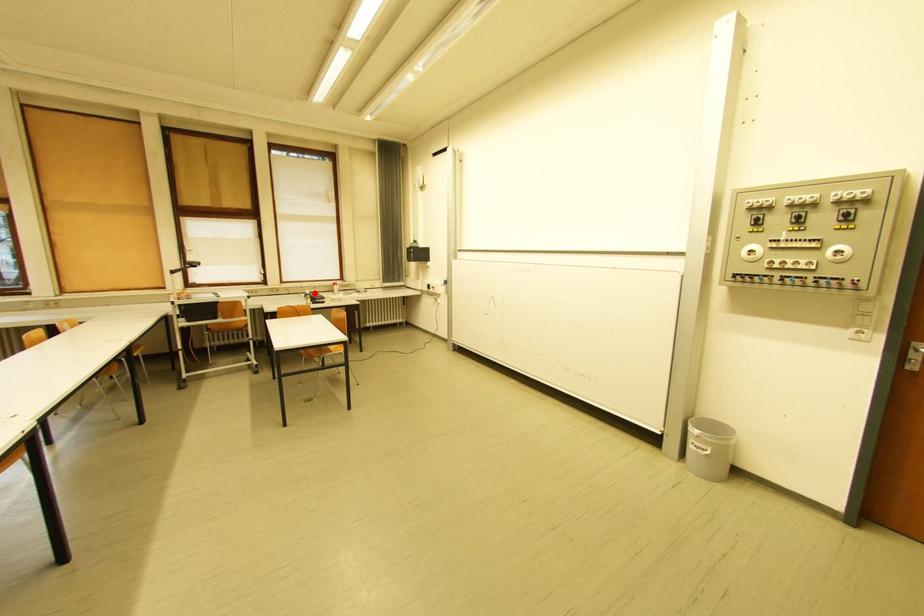
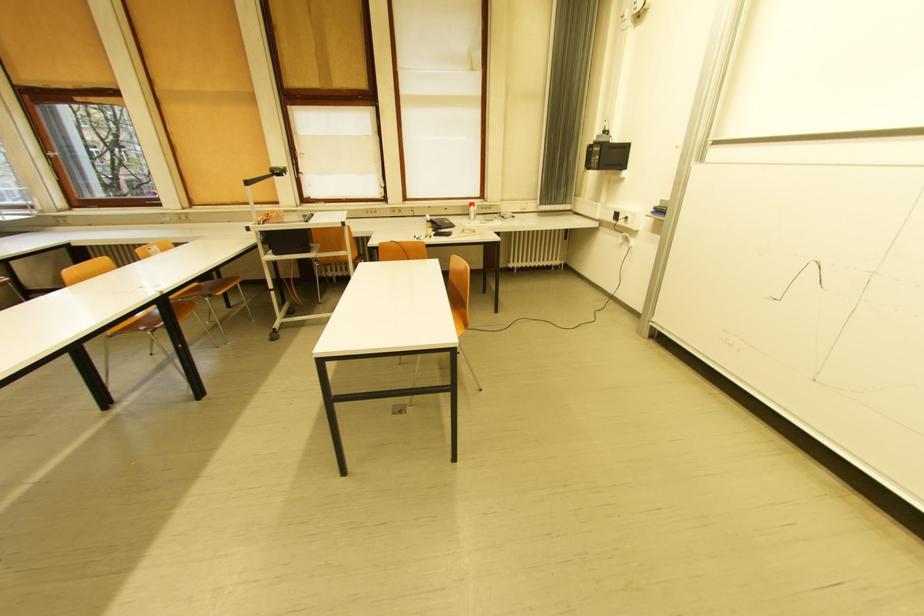
In the second image, find the point that corresponds to the highlighted location in the first image.

(434, 219)